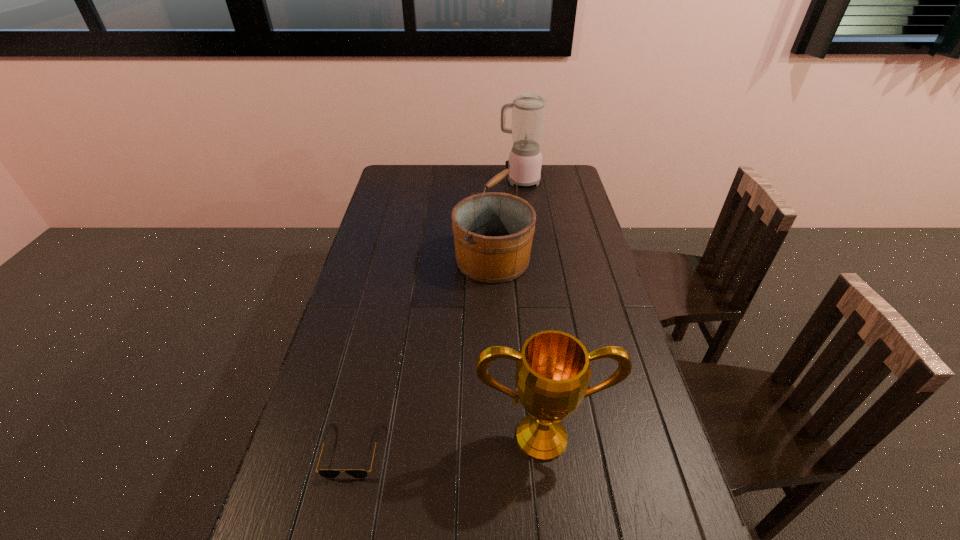
This screenshot has height=540, width=960. I want to click on food processor, so click(528, 109).

This screenshot has width=960, height=540. Find the location of `the second farthest object`. the second farthest object is located at coordinates [493, 231].

Locate an element on the screen. The width and height of the screenshot is (960, 540). award is located at coordinates (553, 368).

Identify the location of the shortest object. (325, 473).

The image size is (960, 540). I want to click on the leftmost object, so click(x=325, y=473).

Locate an element on the screen. Image resolution: width=960 pixels, height=540 pixels. vacant space located on the base of the farthest object near the control knob is located at coordinates [x=435, y=181].

Where is `vacant space located on the base of the farthest object near the control knob`? vacant space located on the base of the farthest object near the control knob is located at coordinates (422, 181).

Find the location of a particular element. The height and width of the screenshot is (540, 960). free space located on the base of the farthest object near the control knob is located at coordinates (440, 181).

Where is `vacant space located 0.350m on the front of the second farthest object`? Image resolution: width=960 pixels, height=540 pixels. vacant space located 0.350m on the front of the second farthest object is located at coordinates (496, 372).

Image resolution: width=960 pixels, height=540 pixels. I want to click on vacant space located 0.090m on the front-facing side of the leftmost object, so click(x=334, y=522).